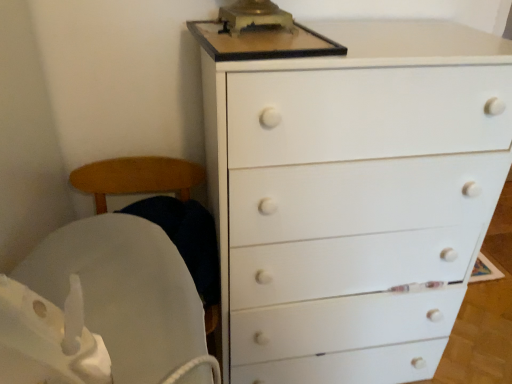
Question: Are white matte chest of drawers at upper right and white fabric rocking chair at left located far from each other?

Choices:
 (A) no
 (B) yes

Answer: (A)

Question: From the image's perspective, is white matte chest of drawers at upper right located above white fabric rocking chair at left?

Choices:
 (A) yes
 (B) no

Answer: (A)

Question: Is white matte chest of drawers at upper right taller than white fabric rocking chair at left?

Choices:
 (A) yes
 (B) no

Answer: (A)

Question: Is white matte chest of drawers at upper right positioned in front of white fabric rocking chair at left?

Choices:
 (A) no
 (B) yes

Answer: (B)

Question: Considering the relative sizes of white matte chest of drawers at upper right and white fabric rocking chair at left in the image provided, is white matte chest of drawers at upper right bigger than white fabric rocking chair at left?

Choices:
 (A) no
 (B) yes

Answer: (B)

Question: Is white matte chest of drawers at upper right shorter than white fabric rocking chair at left?

Choices:
 (A) yes
 (B) no

Answer: (B)

Question: Is white fabric rocking chair at left shorter than white matte chest of drawers at upper right?

Choices:
 (A) yes
 (B) no

Answer: (A)

Question: Is white fabric rocking chair at left next to white matte chest of drawers at upper right and touching it?

Choices:
 (A) no
 (B) yes

Answer: (A)

Question: Would you say white matte chest of drawers at upper right is part of white fabric rocking chair at left's contents?

Choices:
 (A) no
 (B) yes

Answer: (A)

Question: Is white fabric rocking chair at left aimed at white matte chest of drawers at upper right?

Choices:
 (A) no
 (B) yes

Answer: (A)

Question: From the image's perspective, is white fabric rocking chair at left below white matte chest of drawers at upper right?

Choices:
 (A) yes
 (B) no

Answer: (A)

Question: Would you consider white fabric rocking chair at left to be distant from white matte chest of drawers at upper right?

Choices:
 (A) yes
 (B) no

Answer: (B)

Question: From a real-world perspective, is white matte chest of drawers at upper right above or below white fabric rocking chair at left?

Choices:
 (A) above
 (B) below

Answer: (A)